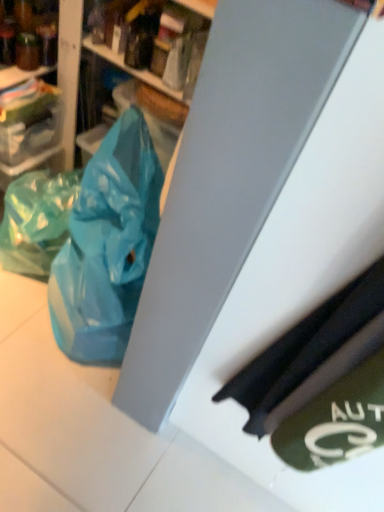
Describe the element at coordinates (36, 220) in the screenshot. I see `translucent blue plastic bag at left` at that location.

At what (x,y) coordinates should I click in order to perform the action: click on translucent blue plastic bag at left. Please return your answer as a coordinate pair (x, y). Looking at the image, I should click on (36, 220).

What are the coordinates of `translucent blue plastic bag at left` in the screenshot? It's located at (36, 220).